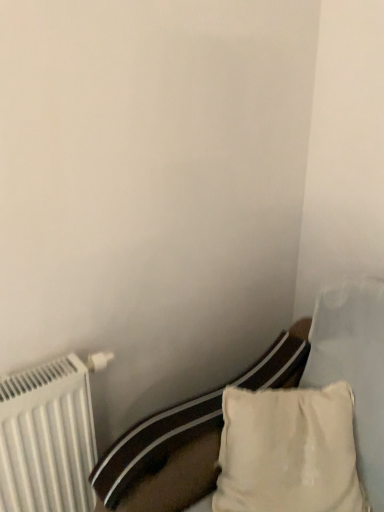
Where is `white cotton pillow at lower right`? The image size is (384, 512). white cotton pillow at lower right is located at coordinates (288, 451).

What is the approximate width of white cotton pillow at lower right?

white cotton pillow at lower right is 33.42 centimeters wide.

What do you see at coordinates (288, 451) in the screenshot? Image resolution: width=384 pixels, height=512 pixels. I see `white cotton pillow at lower right` at bounding box center [288, 451].

Locate an element on the screen. white cotton pillow at lower right is located at coordinates (288, 451).